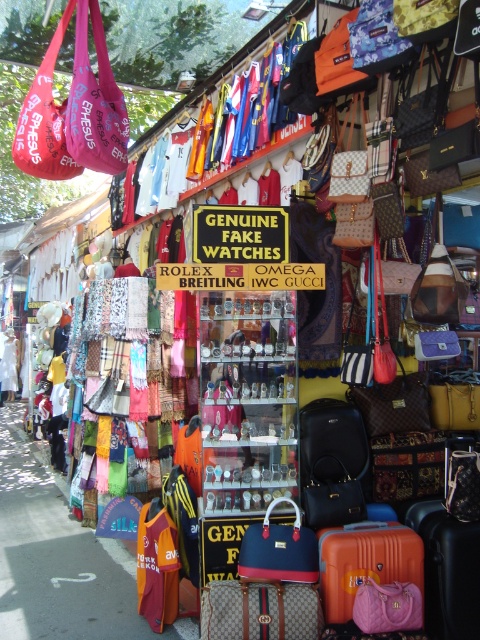
You are a customer at the market stall and want to inspect both the orange leather suitcase at lower right and the pink leather handbag at center. Which item is physically blocking your view of the other?

The orange leather suitcase at lower right is positioned over the pink leather handbag at center, so the orange leather suitcase at lower right is blocking the view of the pink leather handbag at center.

You are a customer at the market stall and want to purchase both the orange matte suitcase at center and the pink leather handbag at center. However, you have limited space in your bag. Which item should you choose if you want the smaller one to carry?

The pink leather handbag at center is smaller in size than the orange matte suitcase at center, so you should choose the pink leather handbag at center if you want the smaller one to carry.

You are a customer at the market stall and want to inspect both the pink fabric bag at upper left and the orange matte suitcase at center. Which item do you need to reach for first to examine it without moving around other items?

You need to reach for the pink fabric bag at upper left first because it is closer to you than the orange matte suitcase at center, which is further away.